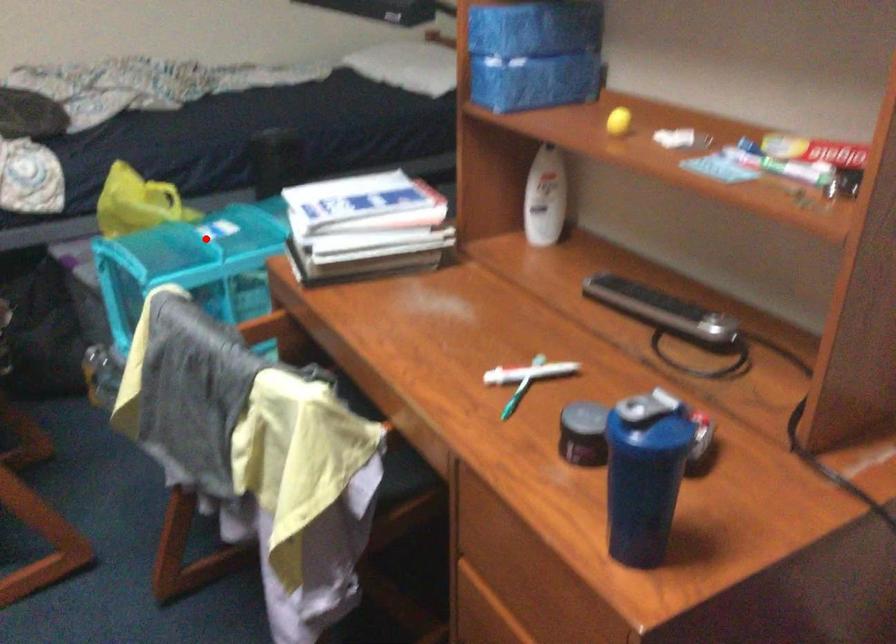
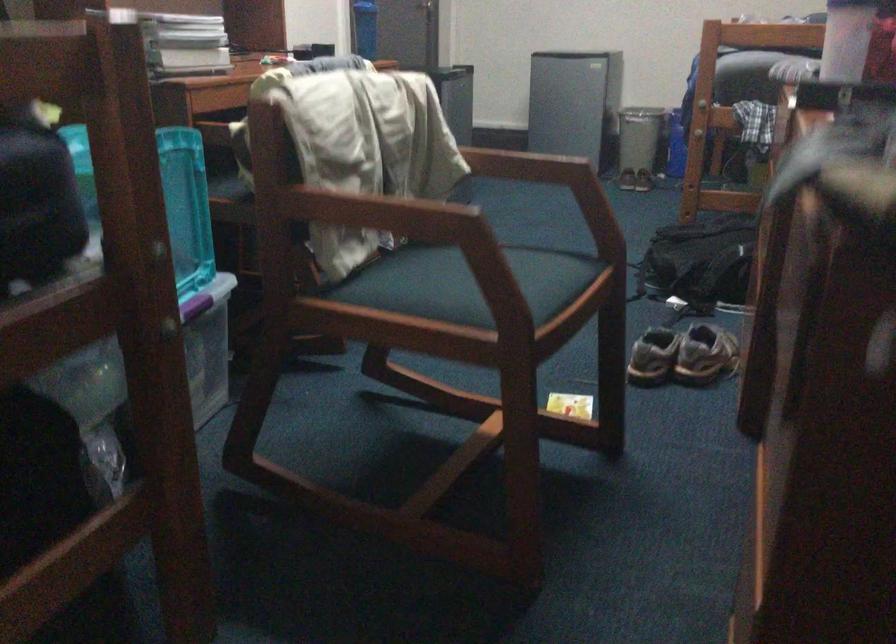
Question: I am providing you with two images of the same scene from different viewpoints. A red point is marked on the first image. Is the red point's position out of view in image 2?

Choices:
 (A) Yes
 (B) No

Answer: (A)